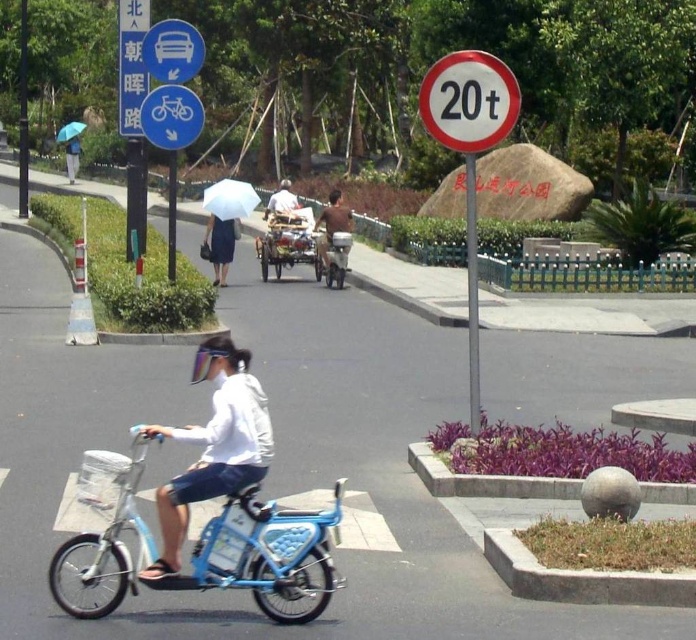
Question: Which point is farther to the camera?

Choices:
 (A) (120, 129)
 (B) (280, 208)
 (C) (177, 33)
 (D) (340, 208)

Answer: (B)

Question: Considering the relative positions of white matte jacket at center and light brown wooden cart at center in the image provided, where is white matte jacket at center located with respect to light brown wooden cart at center?

Choices:
 (A) below
 (B) above

Answer: (A)

Question: Does brushed metal car at upper center appear over brown leather jacket at center?

Choices:
 (A) yes
 (B) no

Answer: (A)

Question: Which point is closer to the camera?

Choices:
 (A) red reflective sign at upper center
 (B) brown leather jacket at center
 (C) light brown wooden cart at center
 (D) dark blue skirt at center

Answer: (A)

Question: Does blue metallic bicycle at center have a lesser width compared to brown leather jacket at center?

Choices:
 (A) yes
 (B) no

Answer: (B)

Question: Which object appears closest to the camera in this image?

Choices:
 (A) brown leather jacket at center
 (B) dark blue skirt at center
 (C) red reflective sign at upper center

Answer: (C)